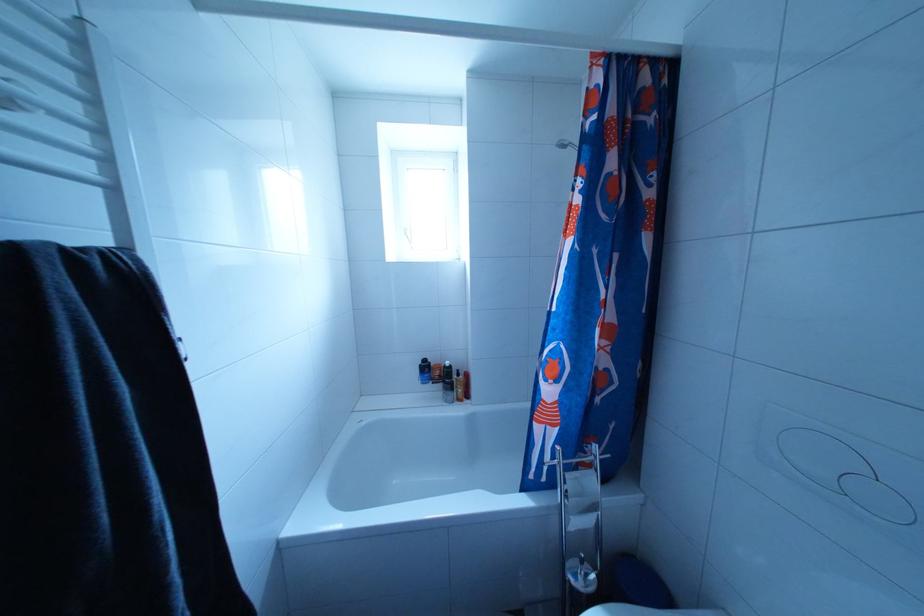
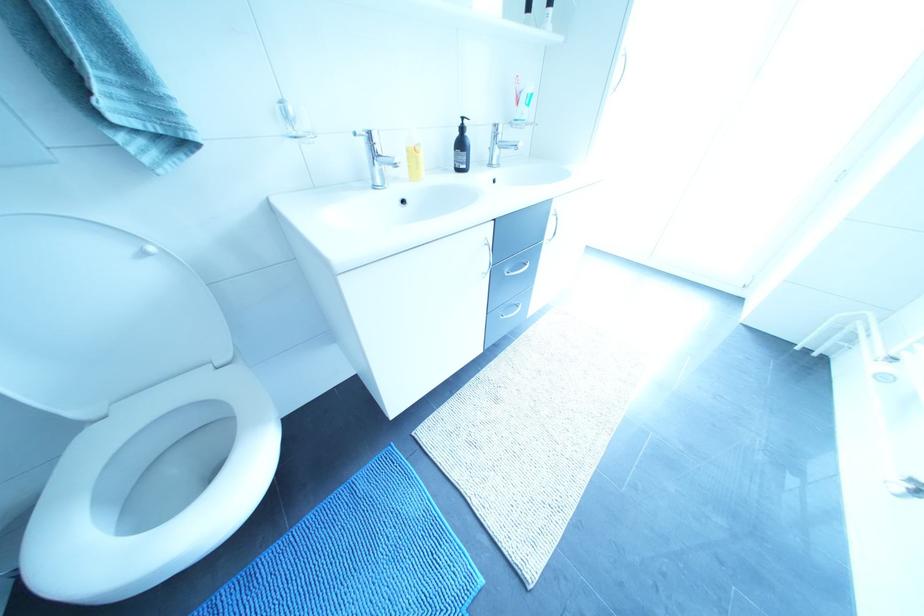
Question: I am providing you with two images of the same scene from different viewpoints. After the viewpoint changes to image2, which objects are now occluded?

Choices:
 (A) black dispenser pump
 (B) red food can
 (C) dark shampoo bottle
 (D) clear toothbrush cup

Answer: (C)